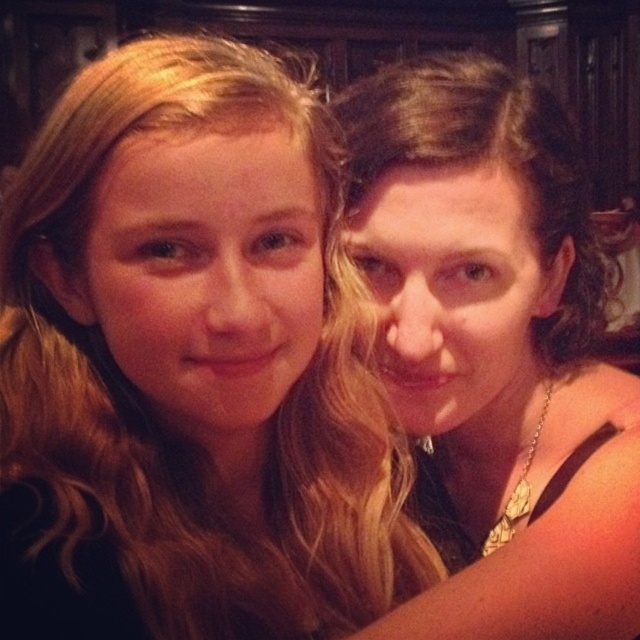
Question: Can you confirm if blonde hair at center is wider than matte gold necklace at upper right?

Choices:
 (A) no
 (B) yes

Answer: (A)

Question: Which object is farther from the camera taking this photo?

Choices:
 (A) matte gold necklace at upper right
 (B) blonde hair at center

Answer: (A)

Question: Is blonde hair at center wider than matte gold necklace at upper right?

Choices:
 (A) yes
 (B) no

Answer: (B)

Question: Can you confirm if blonde hair at center is wider than matte gold necklace at upper right?

Choices:
 (A) yes
 (B) no

Answer: (B)

Question: Which point is farther to the camera?

Choices:
 (A) (68, 477)
 (B) (492, 67)

Answer: (B)